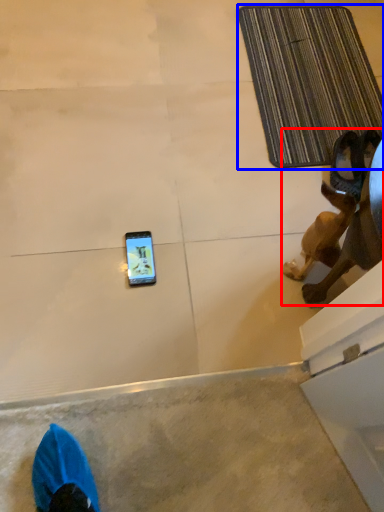
Question: Which of the following is the closest to the observer, animal (highlighted by a red box) or bath mat (highlighted by a blue box)?

Choices:
 (A) animal
 (B) bath mat

Answer: (A)